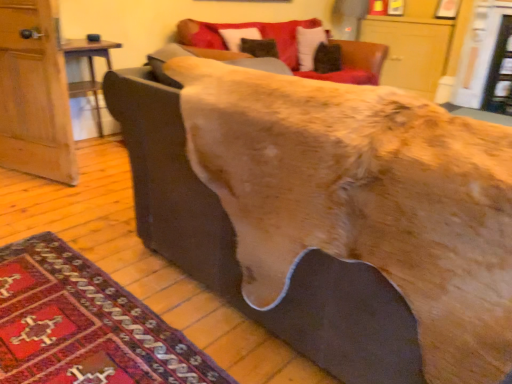
Question: Is carpeted rug at lower left to the left of velvet-like brown pillow at upper center from the viewer's perspective?

Choices:
 (A) yes
 (B) no

Answer: (A)

Question: Is carpeted rug at lower left not inside velvet-like brown pillow at upper center?

Choices:
 (A) yes
 (B) no

Answer: (A)

Question: Is carpeted rug at lower left further to the viewer compared to velvet-like brown pillow at upper center?

Choices:
 (A) no
 (B) yes

Answer: (A)

Question: Does carpeted rug at lower left turn towards velvet-like brown pillow at upper center?

Choices:
 (A) yes
 (B) no

Answer: (B)

Question: Does carpeted rug at lower left have a lesser width compared to velvet-like brown pillow at upper center?

Choices:
 (A) yes
 (B) no

Answer: (B)

Question: From the image's perspective, is carpeted rug at lower left on top of velvet-like brown pillow at upper center?

Choices:
 (A) no
 (B) yes

Answer: (A)

Question: From the image's perspective, is velvet-like brown pillow at upper center beneath brown leather couch at center?

Choices:
 (A) no
 (B) yes

Answer: (A)

Question: From a real-world perspective, is velvet-like brown pillow at upper center located higher than brown leather couch at center?

Choices:
 (A) no
 (B) yes

Answer: (B)

Question: Can you confirm if velvet-like brown pillow at upper center is taller than brown leather couch at center?

Choices:
 (A) yes
 (B) no

Answer: (B)

Question: Is velvet-like brown pillow at upper center at the left side of brown leather couch at center?

Choices:
 (A) yes
 (B) no

Answer: (B)

Question: Considering the relative sizes of velvet-like brown pillow at upper center and brown leather couch at center in the image provided, is velvet-like brown pillow at upper center wider than brown leather couch at center?

Choices:
 (A) yes
 (B) no

Answer: (B)

Question: Is velvet-like brown pillow at upper center at the right side of brown leather couch at center?

Choices:
 (A) no
 (B) yes

Answer: (B)

Question: Would you say velvet-like brown pillow at upper center is part of brown leather couch at center's contents?

Choices:
 (A) no
 (B) yes

Answer: (A)